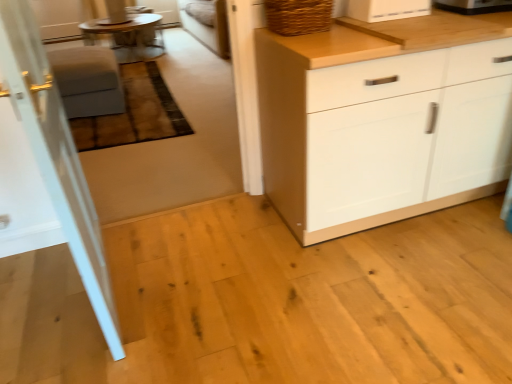
You are a GUI agent. You are given a task and a screenshot of the screen. Output one action in this format:
    pyautogui.click(x=<x>, y=<y>)
    Task: Click on the empty space that is to the right of white glossy door at left
    
    Given the screenshot: What is the action you would take?
    pyautogui.click(x=197, y=287)